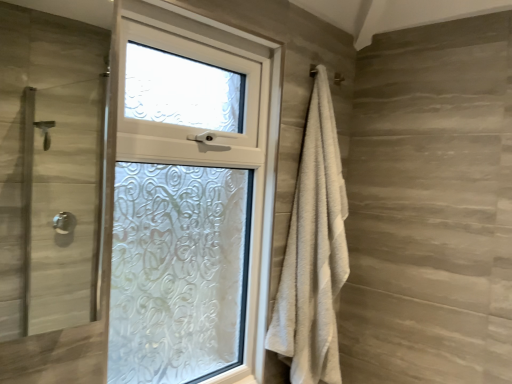
Question: Is clear glass shower door at left wider or thinner than white textured towel at right?

Choices:
 (A) wide
 (B) thin

Answer: (B)

Question: From a real-world perspective, is clear glass shower door at left above or below white textured towel at right?

Choices:
 (A) below
 (B) above

Answer: (B)

Question: Considering the positions of clear glass shower door at left and white textured towel at right in the image, is clear glass shower door at left taller or shorter than white textured towel at right?

Choices:
 (A) tall
 (B) short

Answer: (B)

Question: Considering the positions of white textured towel at right and clear glass shower door at left in the image, is white textured towel at right bigger or smaller than clear glass shower door at left?

Choices:
 (A) small
 (B) big

Answer: (B)

Question: Considering the positions of white textured towel at right and clear glass shower door at left in the image, is white textured towel at right taller or shorter than clear glass shower door at left?

Choices:
 (A) short
 (B) tall

Answer: (B)

Question: From a real-world perspective, is white textured towel at right above or below clear glass shower door at left?

Choices:
 (A) above
 (B) below

Answer: (B)

Question: Is white textured towel at right inside or outside of clear glass shower door at left?

Choices:
 (A) inside
 (B) outside

Answer: (B)